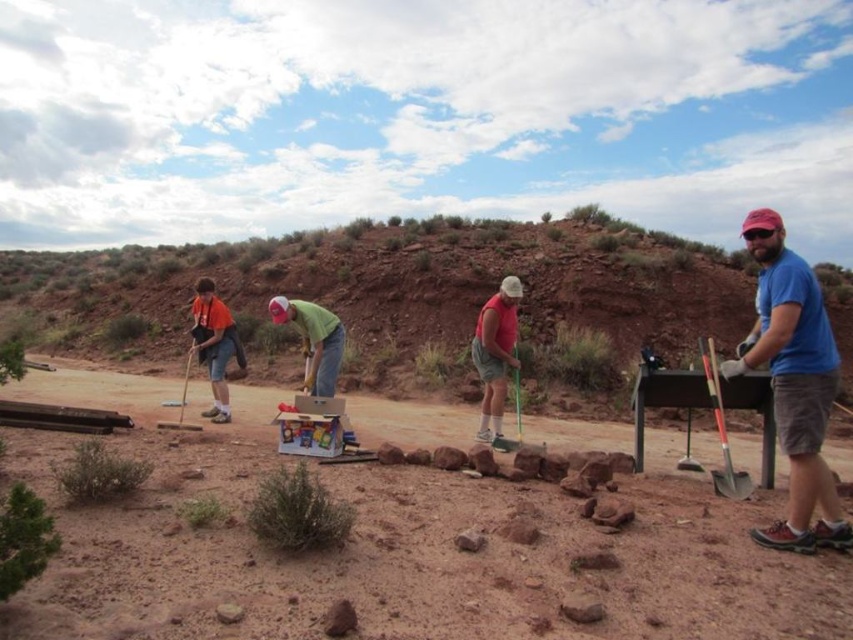
Question: Is brown sandy dirt at center thinner than shiny silver shovel at right?

Choices:
 (A) no
 (B) yes

Answer: (B)

Question: Can you confirm if orange t-shirt at left is thinner than reddish-brown wooden shovel at right?

Choices:
 (A) no
 (B) yes

Answer: (A)

Question: Considering the real-world distances, which object is farthest from the blue fabric shirt at right?

Choices:
 (A) brown sandy dirt at center
 (B) matte red shirt at center
 (C) orange t-shirt at left
 (D) shiny silver shovel at right

Answer: (A)

Question: Considering the real-world distances, which object is closest to the blue fabric shirt at right?

Choices:
 (A) shiny silver shovel at right
 (B) matte red shirt at center
 (C) green matte shirt at center

Answer: (A)

Question: Can you confirm if orange t-shirt at left is bigger than shiny silver shovel at right?

Choices:
 (A) yes
 (B) no

Answer: (A)

Question: Which point is closer to the camera taking this photo?

Choices:
 (A) (695, 467)
 (B) (241, 349)

Answer: (A)